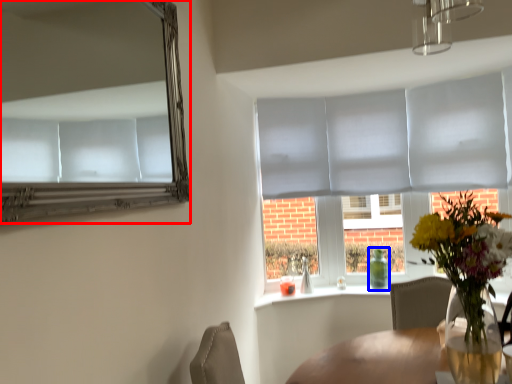
Question: Which object appears closest to the camera in this image, mirror (highlighted by a red box) or bottle (highlighted by a blue box)?

Choices:
 (A) mirror
 (B) bottle

Answer: (A)